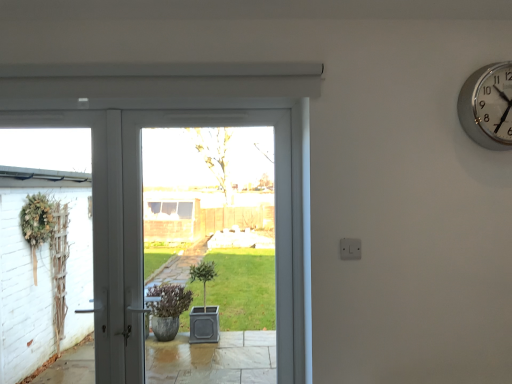
Question: In terms of width, does silver metallic wall clock at upper right look wider or thinner when compared to white glossy door at center?

Choices:
 (A) wide
 (B) thin

Answer: (B)

Question: Considering the positions of point (505, 72) and point (96, 180), is point (505, 72) closer or farther from the camera than point (96, 180)?

Choices:
 (A) farther
 (B) closer

Answer: (B)

Question: In terms of size, does silver metallic wall clock at upper right appear bigger or smaller than white glossy door at center?

Choices:
 (A) small
 (B) big

Answer: (A)

Question: From a real-world perspective, is white glossy door at center above or below silver metallic wall clock at upper right?

Choices:
 (A) below
 (B) above

Answer: (A)

Question: Is white glossy door at center wider or thinner than silver metallic wall clock at upper right?

Choices:
 (A) thin
 (B) wide

Answer: (B)

Question: From the image's perspective, is white glossy door at center above or below silver metallic wall clock at upper right?

Choices:
 (A) below
 (B) above

Answer: (A)

Question: In terms of height, does white glossy door at center look taller or shorter compared to silver metallic wall clock at upper right?

Choices:
 (A) tall
 (B) short

Answer: (A)